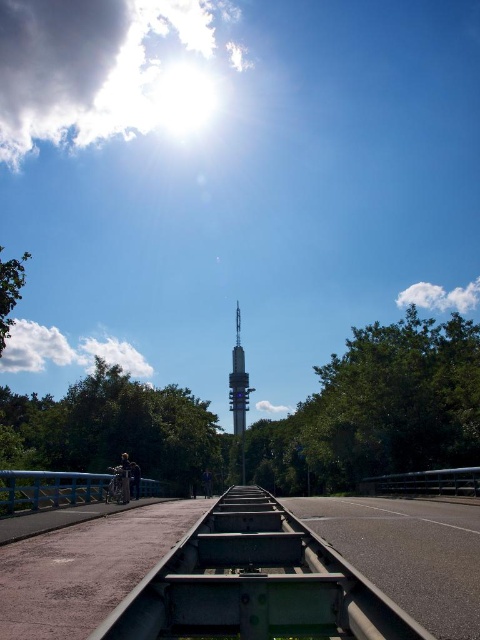
You are a delivery person trying to cross the asphalt road at center. There is a blue painted metal rail at lower left that might block your path. Can you walk around it?

The asphalt road at center is bigger than the blue painted metal rail at lower left, so you can walk around the blue painted metal rail at lower left since it is smaller in size.

You are a photographer trying to capture a photo of two points on a railway track scene. The first point is at coordinate point (256, 614) and the second is at point (60, 481). Based on the scene description, which point is closer to your camera position?

Point (256, 614) is closer to the camera than point (60, 481).